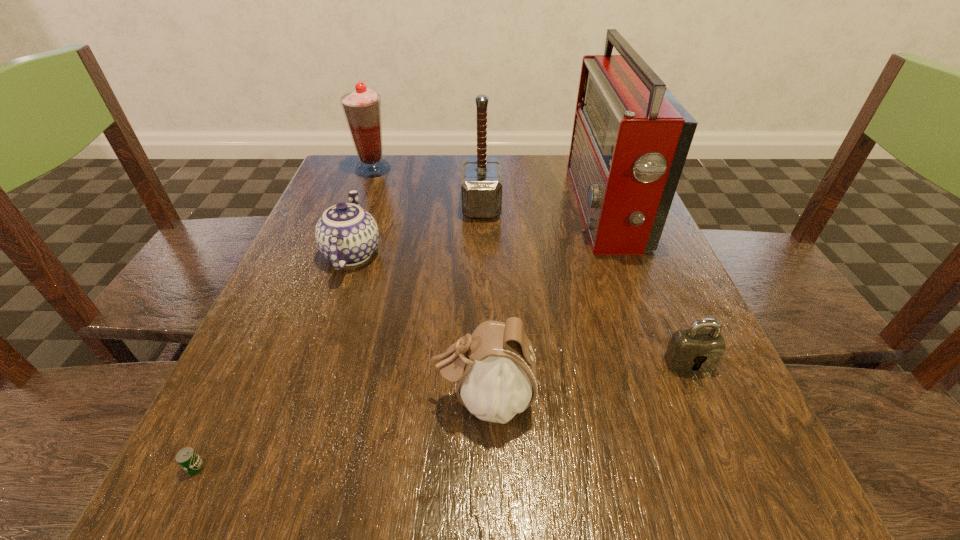
Locate an element on the screen. The height and width of the screenshot is (540, 960). the tallest object is located at coordinates (631, 137).

The image size is (960, 540). In order to click on hammer in this screenshot , I will do `click(481, 187)`.

Locate an element on the screen. The image size is (960, 540). smoothie is located at coordinates (362, 108).

Where is `the fourth shortest object`? The height and width of the screenshot is (540, 960). the fourth shortest object is located at coordinates (494, 369).

Where is `chinaware`? This screenshot has width=960, height=540. chinaware is located at coordinates (347, 235).

The height and width of the screenshot is (540, 960). What are the coordinates of `the second shortest object` in the screenshot? It's located at (693, 350).

Locate an element on the screen. the shortest object is located at coordinates (187, 458).

Where is `beer can`? The image size is (960, 540). beer can is located at coordinates (187, 458).

Identify the location of vacant area situated on the front-facing side of the radio receiver. This screenshot has height=540, width=960. (437, 209).

At what (x,y) coordinates should I click in order to perform the action: click on free space located on the front-facing side of the radio receiver. Please return your answer as a coordinate pair (x, y). The height and width of the screenshot is (540, 960). Looking at the image, I should click on (445, 209).